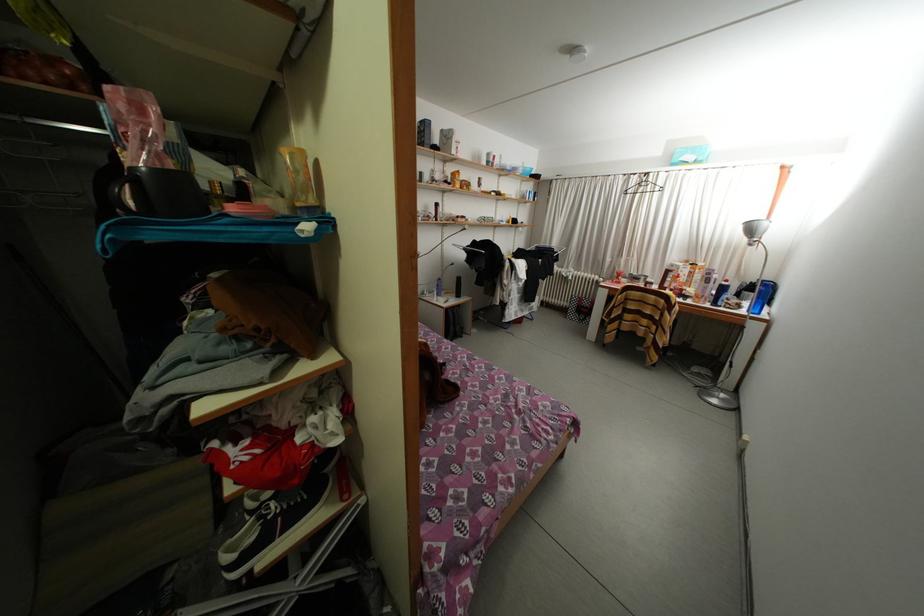
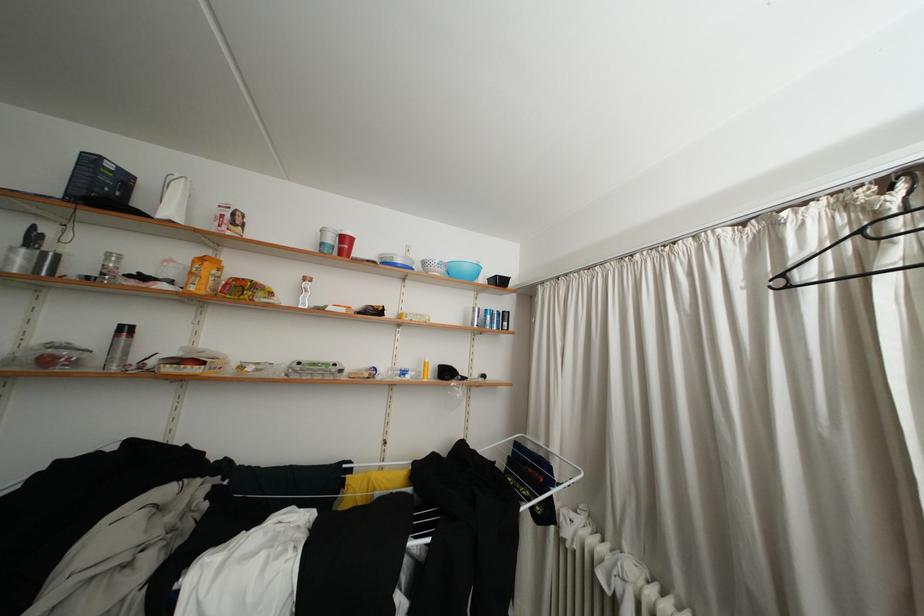
Where in the second image is the point corresponding to the point at 499,164 from the first image?

(338, 245)